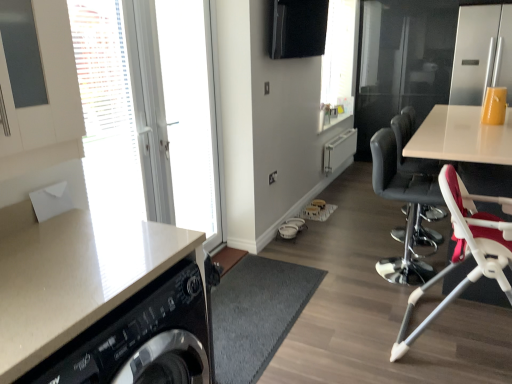
Where is `free space above white glossy countertop at lower left (from a real-world perspective)`? Image resolution: width=512 pixels, height=384 pixels. free space above white glossy countertop at lower left (from a real-world perspective) is located at coordinates (70, 264).